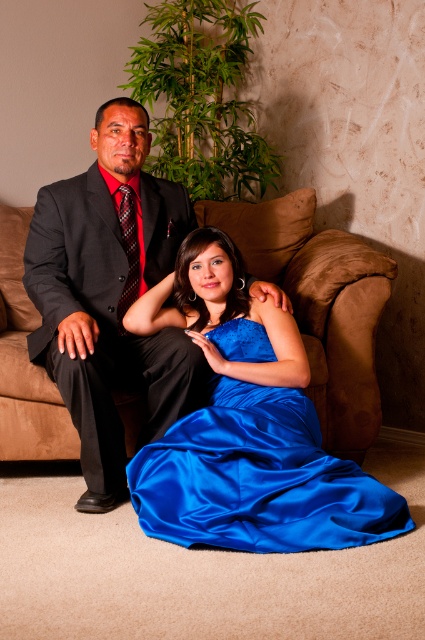
Question: Is satin blue dress at center bigger than black satin suit at left?

Choices:
 (A) yes
 (B) no

Answer: (B)

Question: Can you confirm if satin blue dress at center is smaller than black satin suit at left?

Choices:
 (A) no
 (B) yes

Answer: (B)

Question: Which of these objects is positioned closest to the black satin suit at left?

Choices:
 (A) satin blue dress at center
 (B) brown fabric couch at center

Answer: (A)

Question: Does satin blue dress at center have a lesser width compared to brown fabric couch at center?

Choices:
 (A) yes
 (B) no

Answer: (B)

Question: Estimate the real-world distances between objects in this image. Which object is farther from the black satin suit at left?

Choices:
 (A) satin blue dress at center
 (B) brown fabric couch at center

Answer: (B)

Question: Which of the following is the farthest from the observer?

Choices:
 (A) (175, 248)
 (B) (246, 468)

Answer: (A)